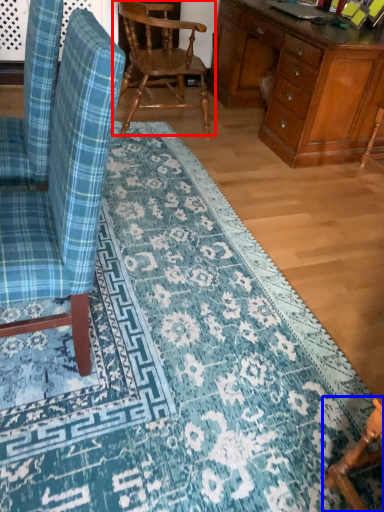
Question: Which object is closer to the camera taking this photo, chair (highlighted by a red box) or chair (highlighted by a blue box)?

Choices:
 (A) chair
 (B) chair

Answer: (B)